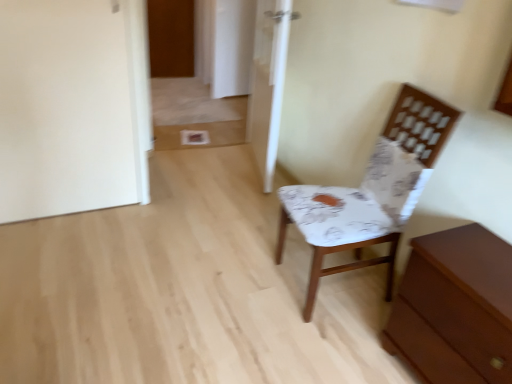
The height and width of the screenshot is (384, 512). What are the coordinates of `vacant space to the left of white fabric chair at right` in the screenshot? It's located at (232, 274).